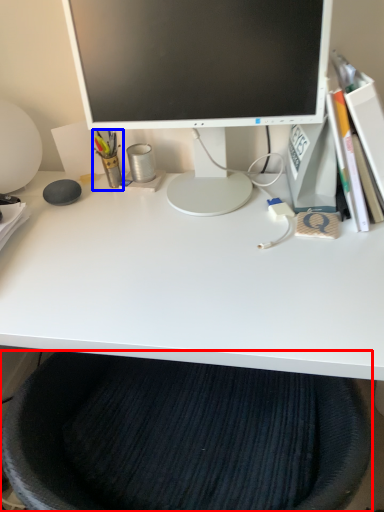
Question: Among these objects, which one is nearest to the camera, computer chair (highlighted by a red box) or stationery (highlighted by a blue box)?

Choices:
 (A) computer chair
 (B) stationery

Answer: (A)